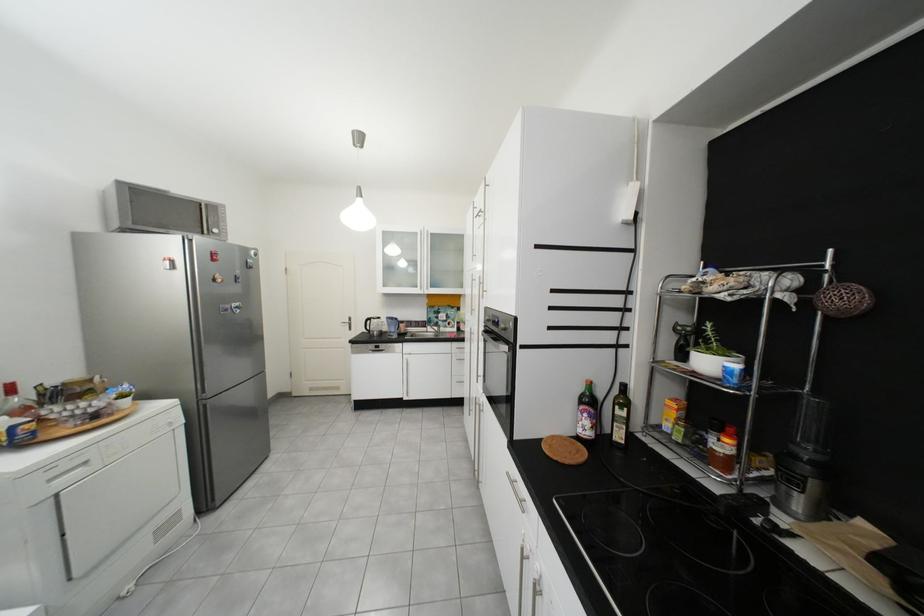
Which object does [373,325] point to?

It refers to a electric kettle.